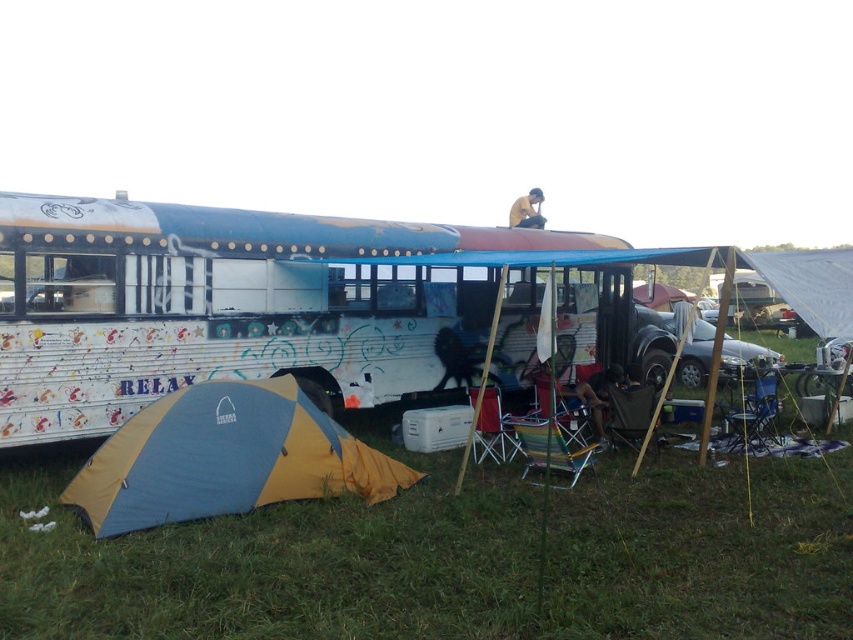
Question: Can you confirm if white painted bus at center is smaller than yellow/blue fabric tent at lower left?

Choices:
 (A) yes
 (B) no

Answer: (A)

Question: Which object is closer to the camera taking this photo?

Choices:
 (A) dark blue fabric chair at lower center
 (B) yellow fabric at upper center
 (C) white painted bus at center

Answer: (C)

Question: Which point is closer to the camera?

Choices:
 (A) pyautogui.click(x=532, y=225)
 (B) pyautogui.click(x=142, y=410)
 (C) pyautogui.click(x=178, y=305)
 (D) pyautogui.click(x=601, y=378)

Answer: (B)

Question: Can you confirm if white painted bus at center is wider than dark blue fabric chair at lower center?

Choices:
 (A) no
 (B) yes

Answer: (A)

Question: Which of the following is the farthest from the observer?

Choices:
 (A) yellow fabric at upper center
 (B) yellow/blue fabric tent at lower left
 (C) dark blue fabric chair at lower center
 (D) white painted bus at center

Answer: (A)

Question: Is white painted bus at center in front of yellow/blue fabric tent at lower left?

Choices:
 (A) no
 (B) yes

Answer: (A)